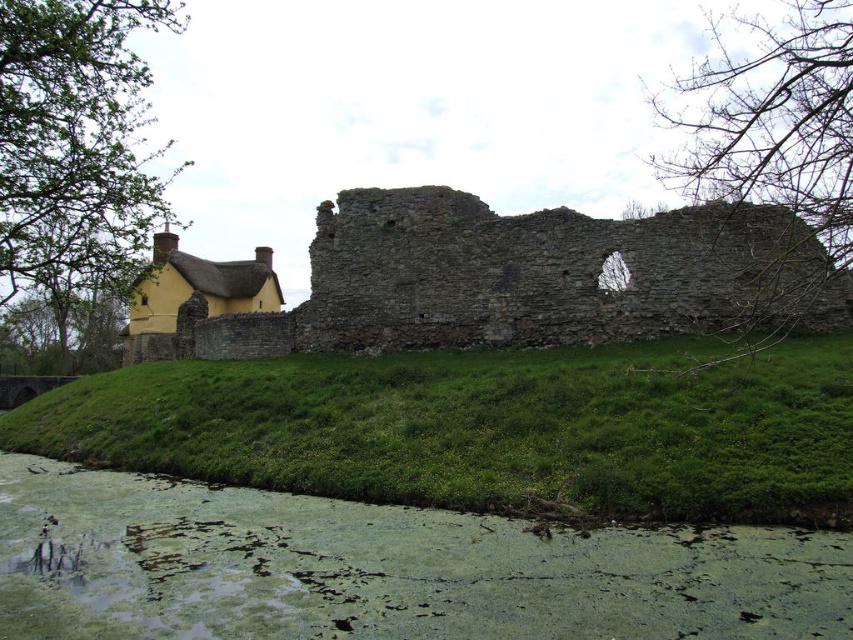
Measure the distance between green grassy hillside at lower left and rustic stone wall at center.

They are 13.99 meters apart.

Is green grassy hillside at lower left further to the viewer compared to rustic stone wall at center?

No, green grassy hillside at lower left is in front of rustic stone wall at center.

Is point (16, 424) positioned in front of point (445, 342)?

No.

Identify the location of green grassy hillside at lower left. (485, 428).